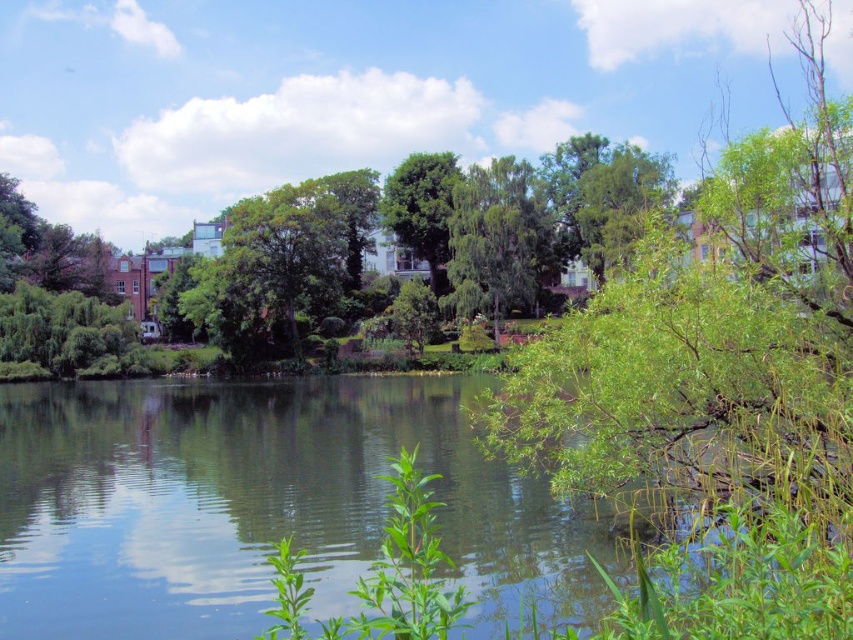
Question: Which object is closer to the camera taking this photo?

Choices:
 (A) green leafy water at center
 (B) green leafy tree at center
 (C) green leafy branch at center

Answer: (C)

Question: Estimate the real-world distances between objects in this image. Which object is farther from the green leafy tree at center?

Choices:
 (A) green leafy branch at center
 (B) green leafy water at center

Answer: (B)

Question: Can you confirm if green leafy branch at center is wider than green leafy tree at center?

Choices:
 (A) no
 (B) yes

Answer: (B)

Question: Can you confirm if green leafy water at center is smaller than green leafy branch at center?

Choices:
 (A) yes
 (B) no

Answer: (A)

Question: Does green leafy water at center have a larger size compared to green leafy tree at center?

Choices:
 (A) yes
 (B) no

Answer: (A)

Question: Which point is farther to the camera?

Choices:
 (A) (160, 536)
 (B) (534, 269)

Answer: (B)